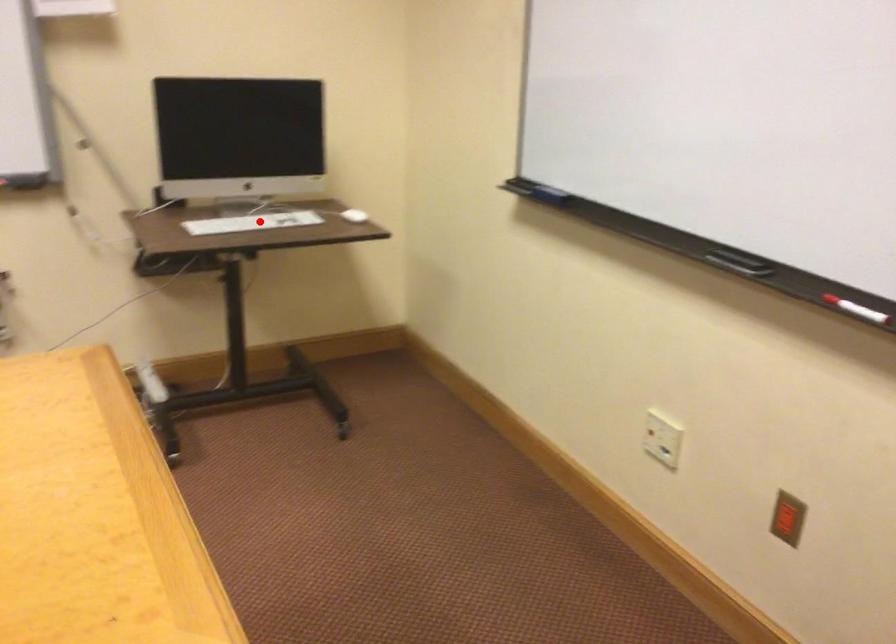
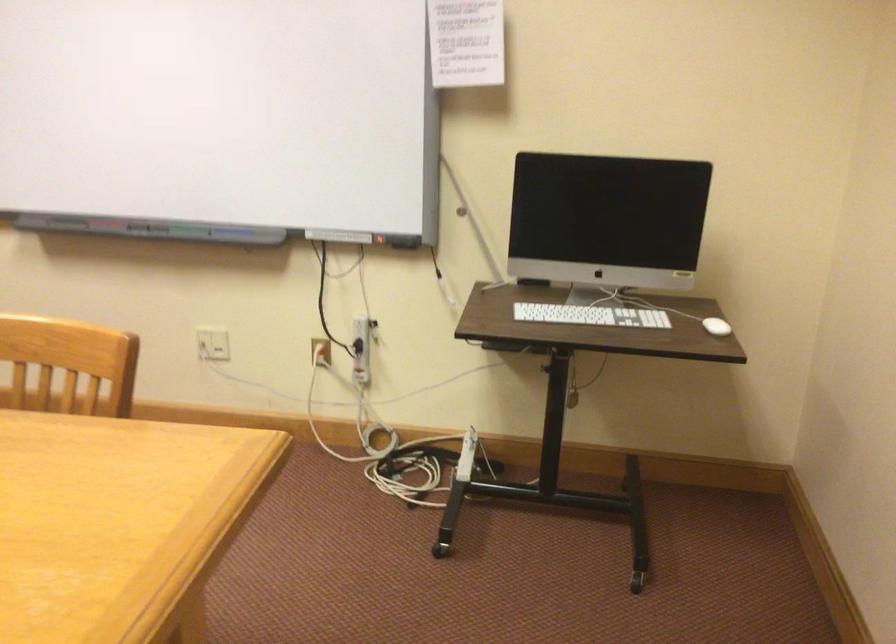
Find the pixel in the second image that matches the highlighted location in the first image.

(590, 315)